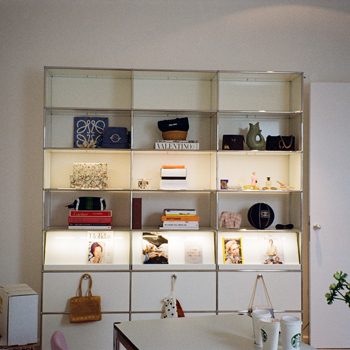
This screenshot has height=350, width=350. In order to click on white door in this screenshot , I will do `click(329, 189)`.